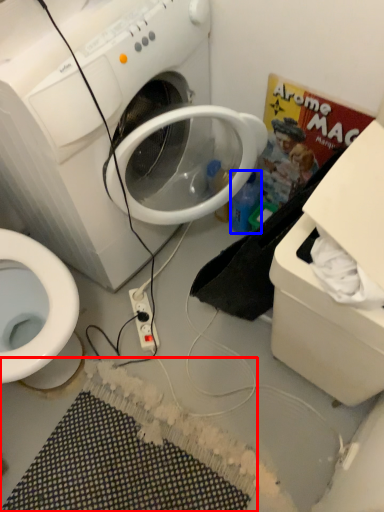
Question: Which object is further to the camera taking this photo, bath mat (highlighted by a red box) or bottle (highlighted by a blue box)?

Choices:
 (A) bath mat
 (B) bottle

Answer: (B)